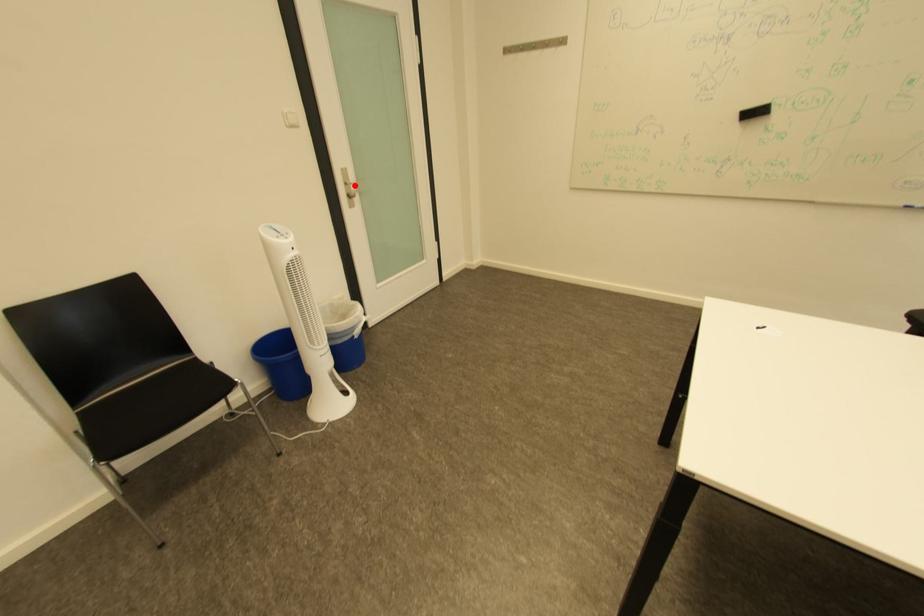
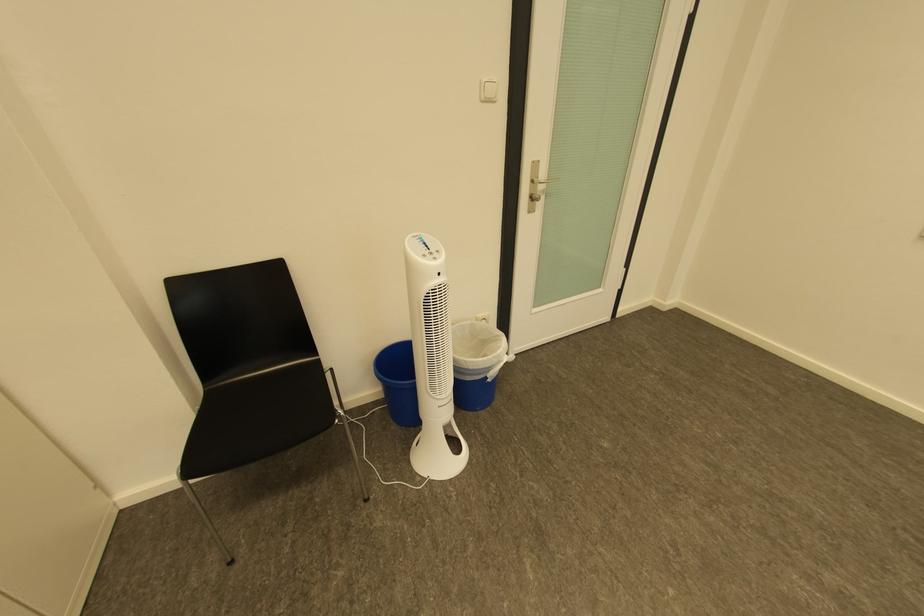
Locate, in the second image, the point that corresponds to the highlighted location in the first image.

(541, 182)